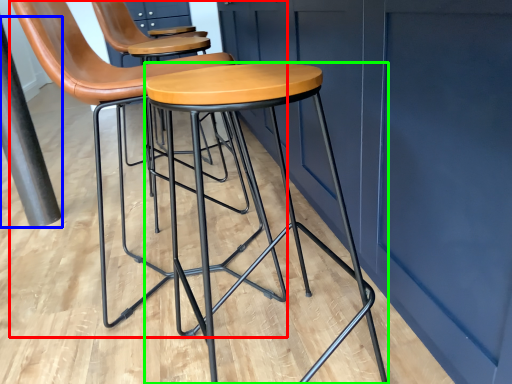
Question: Which object is the farthest from chair (highlighted by a red box)? Choose among these: pole (highlighted by a blue box) or stool (highlighted by a green box).

Choices:
 (A) pole
 (B) stool

Answer: (A)